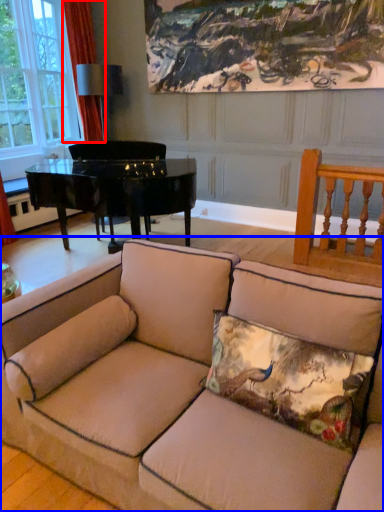
Question: Which object is closer to the camera taking this photo, curtain (highlighted by a red box) or studio couch (highlighted by a blue box)?

Choices:
 (A) curtain
 (B) studio couch

Answer: (B)